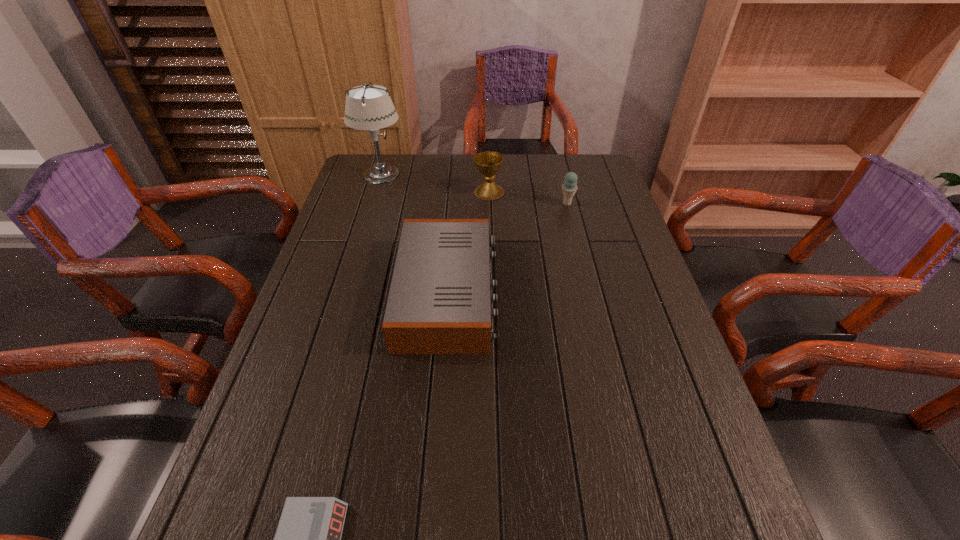
At what (x,y) coordinates should I click in order to perform the action: click on free space between the radio receiver and the ice cream. Please return your answer as a coordinate pair (x, y). Looking at the image, I should click on (508, 248).

You are a GUI agent. You are given a task and a screenshot of the screen. Output one action in this format:
    pyautogui.click(x=<x>, y=<y>)
    Task: Click on the free space between the lampshade and the chalice
    
    Given the screenshot: What is the action you would take?
    pyautogui.click(x=435, y=183)

Point out which object is positioned as the second nearest to the radio receiver. Please provide its 2D coordinates. Your answer should be formatted as a tuple, i.e. [(x, y)], where the tuple contains the x and y coordinates of a point satisfying the conditions above.

[(569, 188)]

Identify which object is located as the nearest to the tallest object. Please provide its 2D coordinates. Your answer should be formatted as a tuple, i.e. [(x, y)], where the tuple contains the x and y coordinates of a point satisfying the conditions above.

[(488, 164)]

Image resolution: width=960 pixels, height=540 pixels. Identify the location of vacant space that satisfies the following two spatial constraints: 1. on the front side of the ice cream; 2. on the front panel of the second nearest object. (589, 293).

Locate an element on the screen. This screenshot has height=540, width=960. free space that satisfies the following two spatial constraints: 1. on the lampshade of the rightmost object; 2. on the right side of the lampshade is located at coordinates (372, 204).

Locate an element on the screen. The height and width of the screenshot is (540, 960). vacant space that satisfies the following two spatial constraints: 1. on the lampshade of the lampshade; 2. on the right side of the rightmost object is located at coordinates 372,204.